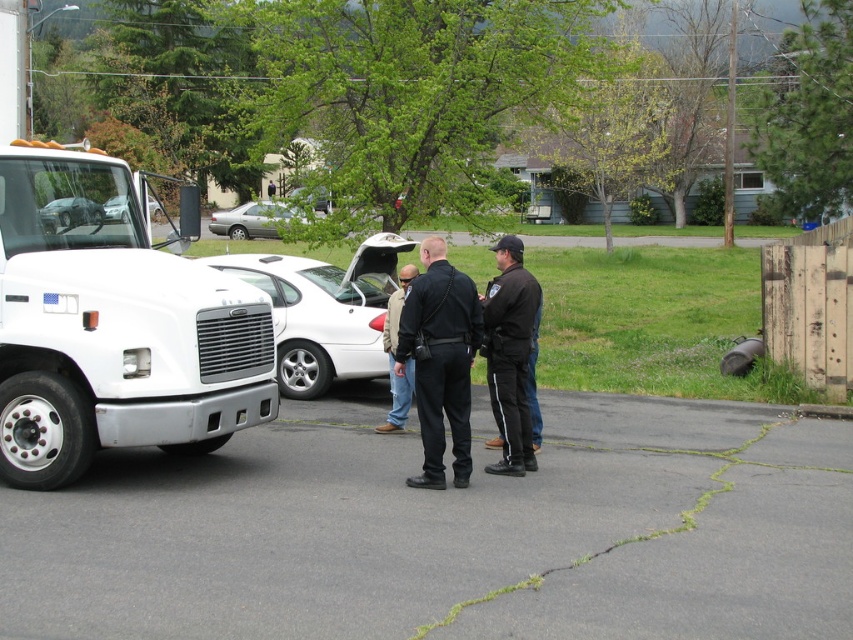
You are standing in the parking lot and see the white glossy sedan at center and the khaki pants at center. Which object is positioned more to the right?

The khaki pants at center is positioned more to the right than the white glossy sedan at center.

You are trying to park your car in a parking spot that is exactly the width of the khaki pants at center. Can the white glossy sedan at center fit into this parking spot?

The white glossy sedan at center might be wider than khaki pants at center, so it might not fit into the parking spot.